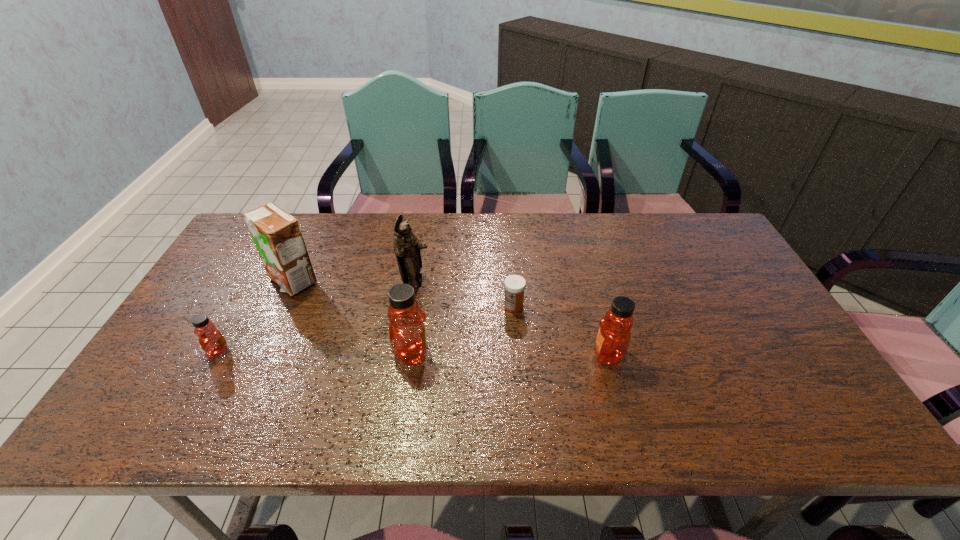
Locate an element on the screen. The height and width of the screenshot is (540, 960). vacant area that lies between the fourth nearest object and the figurine is located at coordinates (465, 294).

Where is `free spot between the carton and the figurine`? The width and height of the screenshot is (960, 540). free spot between the carton and the figurine is located at coordinates (353, 281).

Locate an element on the screen. This screenshot has height=540, width=960. free space between the shortest honey and the figurine is located at coordinates (317, 316).

This screenshot has width=960, height=540. What are the coordinates of `free space that is in between the carton and the second shortest honey` in the screenshot? It's located at (450, 318).

The width and height of the screenshot is (960, 540). Find the location of `free spot between the rightmost object and the second honey from right to left`. free spot between the rightmost object and the second honey from right to left is located at coordinates (510, 354).

The height and width of the screenshot is (540, 960). What are the coordinates of `vacant space in between the carton and the second honey from left to right` in the screenshot? It's located at pyautogui.click(x=352, y=317).

What are the coordinates of `the second closest object relative to the leftmost honey` in the screenshot? It's located at (407, 334).

You are a GUI agent. You are given a task and a screenshot of the screen. Output one action in this format:
    pyautogui.click(x=<x>, y=<y>)
    Task: Click on the object that is the second closest one to the second honey from left to right
    The width and height of the screenshot is (960, 540).
    Given the screenshot: What is the action you would take?
    pyautogui.click(x=514, y=285)

Select which honey appears as the second closest to the carton. Please provide its 2D coordinates. Your answer should be formatted as a tuple, i.e. [(x, y)], where the tuple contains the x and y coordinates of a point satisfying the conditions above.

[(407, 334)]

You are a GUI agent. You are given a task and a screenshot of the screen. Output one action in this format:
    pyautogui.click(x=<x>, y=<y>)
    Task: Click on the third closest honey to the figurine
    The image size is (960, 540).
    Given the screenshot: What is the action you would take?
    pyautogui.click(x=613, y=339)